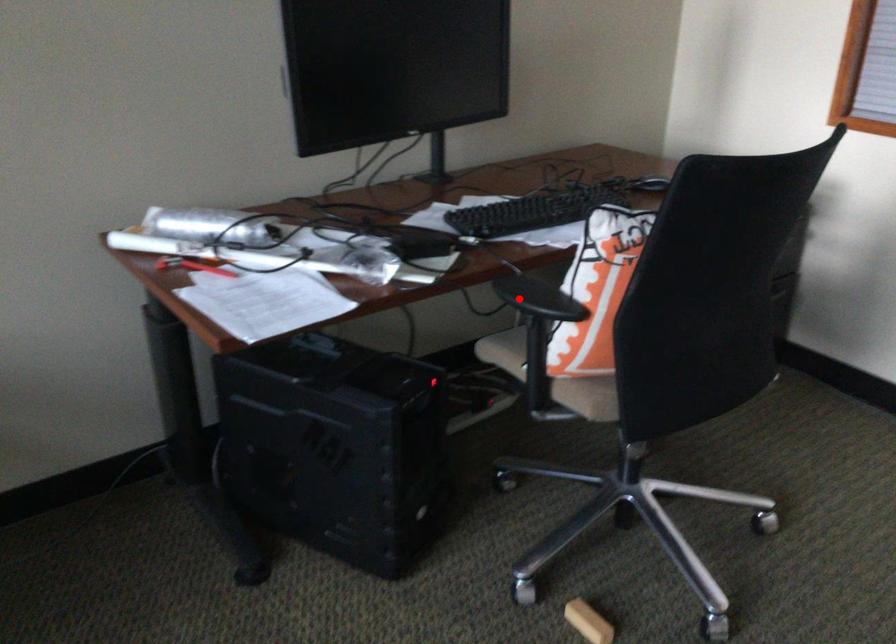
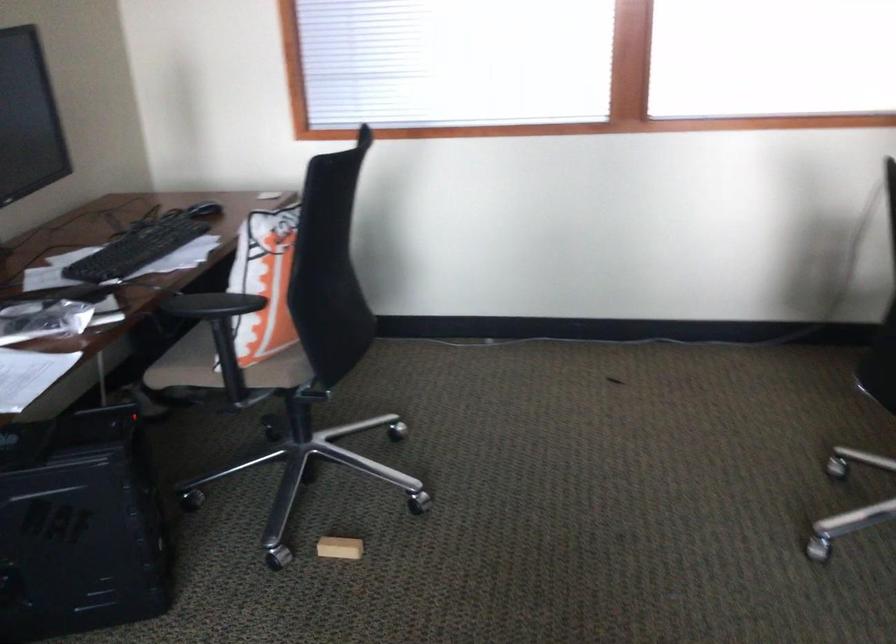
Locate, in the second image, the point that corresponds to the highlighted location in the first image.

(211, 305)